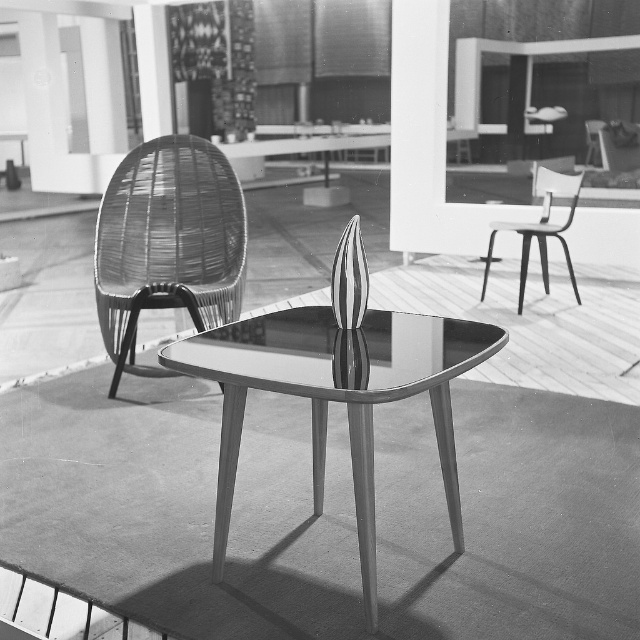
Can you confirm if woven rattan chair at left is shorter than metallic silver chair at right?

Incorrect, woven rattan chair at left's height does not fall short of metallic silver chair at right's.

Which is more to the right, woven rattan chair at left or metallic silver chair at right?

From the viewer's perspective, metallic silver chair at right appears more on the right side.

Does point (141, 296) lie behind point (572, 282)?

No, (141, 296) is in front of (572, 282).

At what (x,y) coordinates should I click in order to perform the action: click on woven rattan chair at left. Please return your answer as a coordinate pair (x, y). The height and width of the screenshot is (640, 640). Looking at the image, I should click on (168, 243).

Is point (225, 412) closer to viewer compared to point (550, 227)?

Yes, it is.

Between metallic glass table at center and metallic silver chair at right, which one is positioned higher?

metallic silver chair at right

Where is `metallic glass table at center`? metallic glass table at center is located at coordinates (337, 396).

Locate an element on the screen. metallic glass table at center is located at coordinates (337, 396).

Can you confirm if metallic glass table at center is positioned to the right of woven rattan chair at left?

Correct, you'll find metallic glass table at center to the right of woven rattan chair at left.

Who is more distant from viewer, (332, 344) or (198, 250)?

The point (198, 250) is behind.

The width and height of the screenshot is (640, 640). I want to click on metallic glass table at center, so click(337, 396).